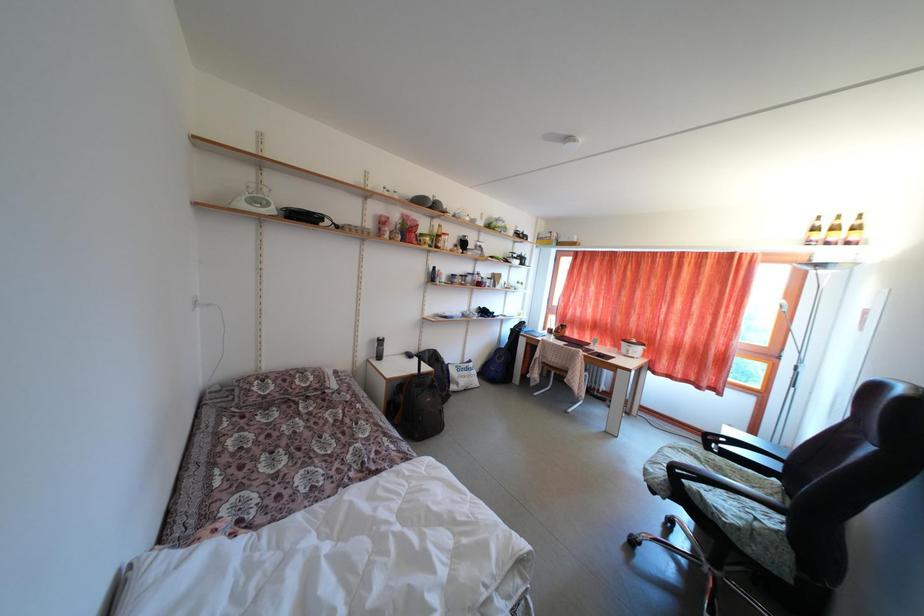
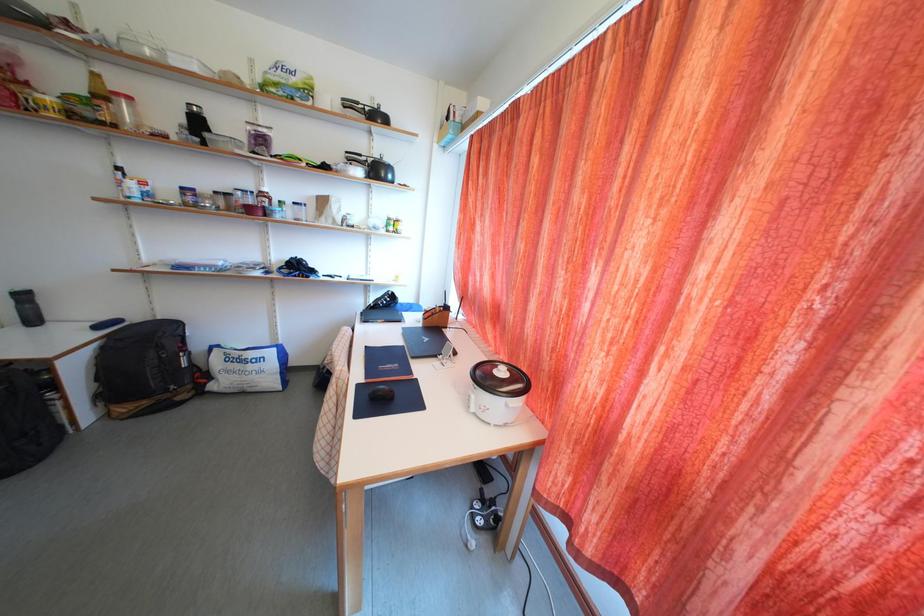
The images are taken continuously from a first-person perspective. In which direction are you moving?

The cameraman moved toward right, forward.